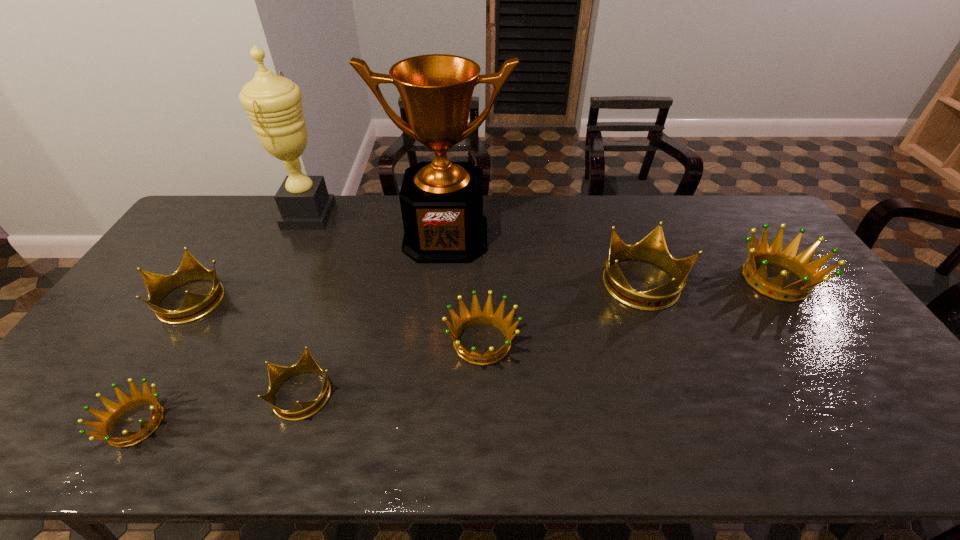
Locate an element on the screen. This screenshot has width=960, height=540. unoccupied position between the leftmost golden crown and the fifth object from right to left is located at coordinates (220, 409).

Find the location of a particular element. Image resolution: width=960 pixels, height=540 pixels. empty space between the nearest golden crown and the leftmost gold crown is located at coordinates click(163, 361).

Where is `vacant area that lies between the leftmost gold crown and the second smallest golden crown`? Image resolution: width=960 pixels, height=540 pixels. vacant area that lies between the leftmost gold crown and the second smallest golden crown is located at coordinates (336, 321).

Where is `free point between the right trophy cup and the fourth crown from left to right`? This screenshot has width=960, height=540. free point between the right trophy cup and the fourth crown from left to right is located at coordinates (464, 289).

The image size is (960, 540). I want to click on empty location between the biggest gold crown and the leftmost gold crown, so click(417, 292).

Identify the location of free spot between the rightmost crown and the second biggest gold crown. This screenshot has width=960, height=540. (483, 289).

Find the location of `vacant region between the second golden crown from left to right and the fifth crown from left to right`. vacant region between the second golden crown from left to right and the fifth crown from left to right is located at coordinates click(563, 313).

This screenshot has height=540, width=960. What are the coordinates of `free space that is in between the right trophy cup and the nearest gold crown` in the screenshot? It's located at (374, 315).

In order to click on vacant region between the smallest gold crown and the sixth object from right to left in this screenshot , I will do `click(306, 305)`.

Locate an element on the screen. object that is the fifth closest one to the fourth crown from left to right is located at coordinates (126, 403).